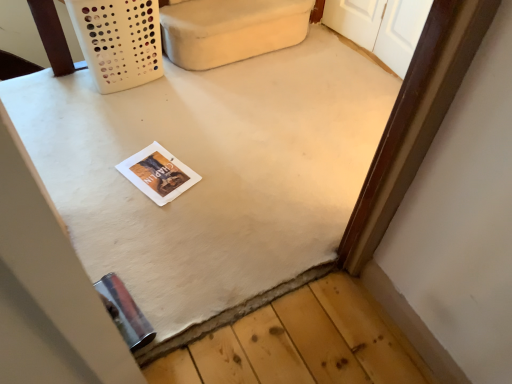
In order to click on free space underneath white paper magazine at center (from a real-world perspective) in this screenshot , I will do `click(149, 170)`.